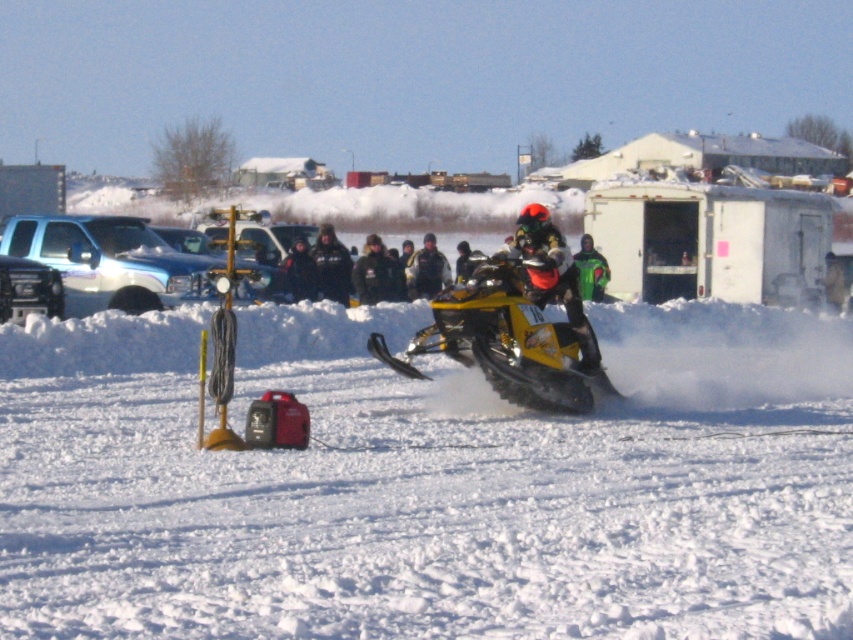
You are a photographer at the snowmobile race. You want to capture a photo of the black leather jacket at center and the white fluffy snow at center. Which object is closer to the camera?

The black leather jacket at center is closer to the camera because it is positioned over the white fluffy snow at center, which is underneath it.

You are a photographer trying to capture the snowmobile race. You notice the white fluffy snow at center and the black leather jacket at center. Which object should you focus on first if you want to photograph the foreground elements?

The white fluffy snow at center is in front of the black leather jacket at center, so you should focus on the white fluffy snow at center first to capture the foreground elements.